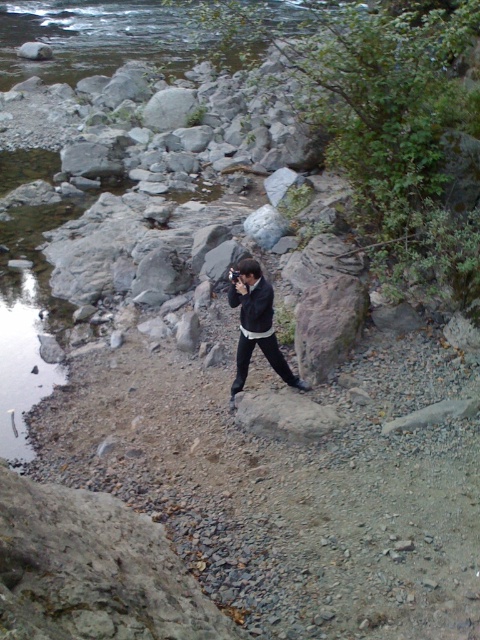
Question: Can you confirm if gray rough rock at center is positioned to the right of matte black jacket at center?

Choices:
 (A) yes
 (B) no

Answer: (A)

Question: Which point is closer to the camera?

Choices:
 (A) gray rough rock at center
 (B) matte black jacket at center

Answer: (B)

Question: Is gray rough rock at center to the right of matte black jacket at center from the viewer's perspective?

Choices:
 (A) no
 (B) yes

Answer: (B)

Question: Among these points, which one is farthest from the camera?

Choices:
 (A) (245, 307)
 (B) (308, 358)

Answer: (B)

Question: Can you confirm if gray rough rock at center is smaller than matte black jacket at center?

Choices:
 (A) yes
 (B) no

Answer: (A)